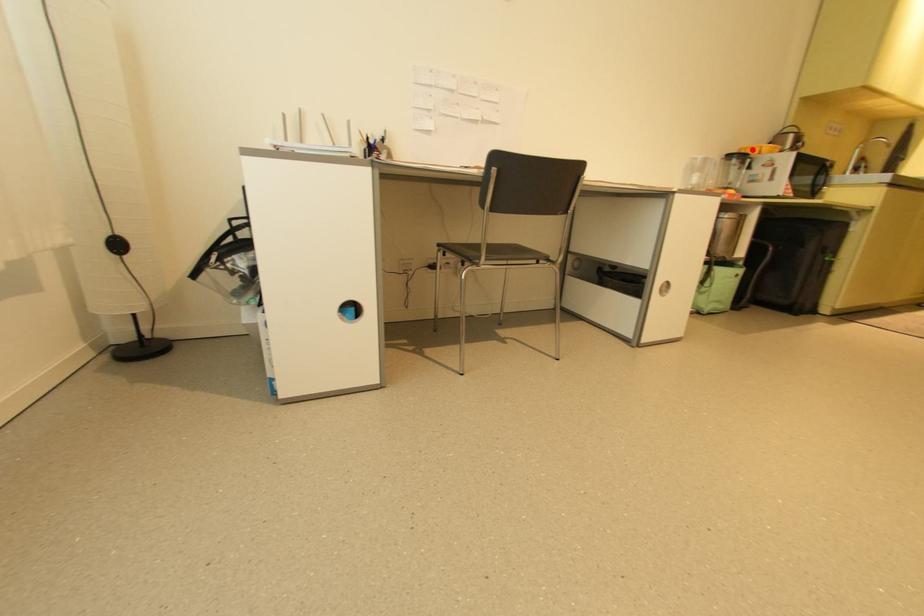
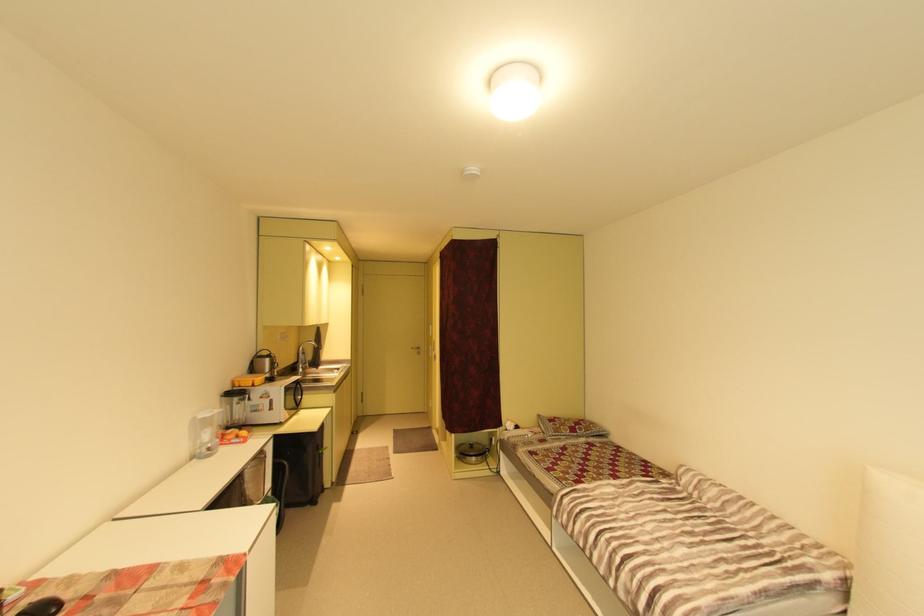
The point at the highlighted location is marked in the first image. Where is the corresponding point in the second image?

(246, 381)